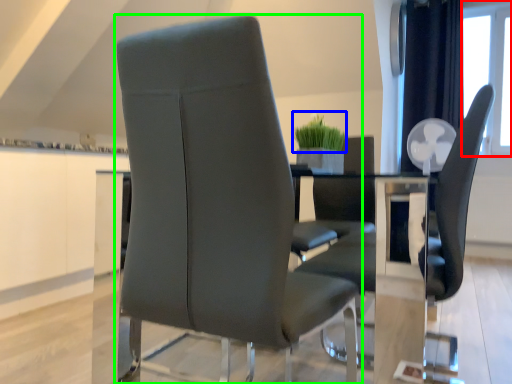
Question: Which is nearer to the window screen (highlighted by a red box)? plant (highlighted by a blue box) or chair (highlighted by a green box).

Choices:
 (A) plant
 (B) chair

Answer: (A)